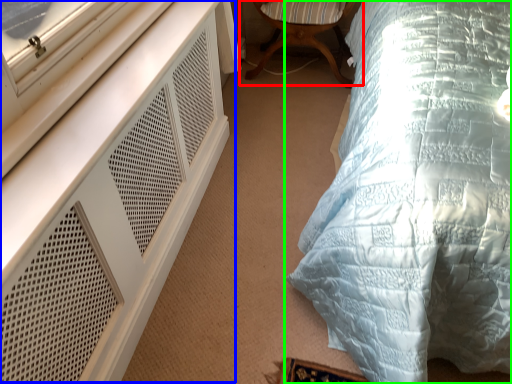
Question: Considering the real-world distances, which object is closest to chair (highlighted by a red box)? dresser (highlighted by a blue box) or bed (highlighted by a green box).

Choices:
 (A) dresser
 (B) bed

Answer: (B)